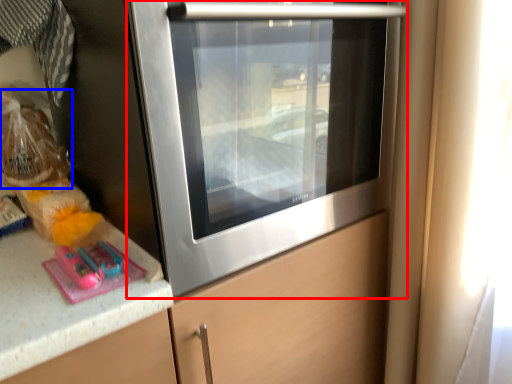
Question: Which of the following is the closest to the observer, home appliance (highlighted by a red box) or food (highlighted by a blue box)?

Choices:
 (A) home appliance
 (B) food

Answer: (A)